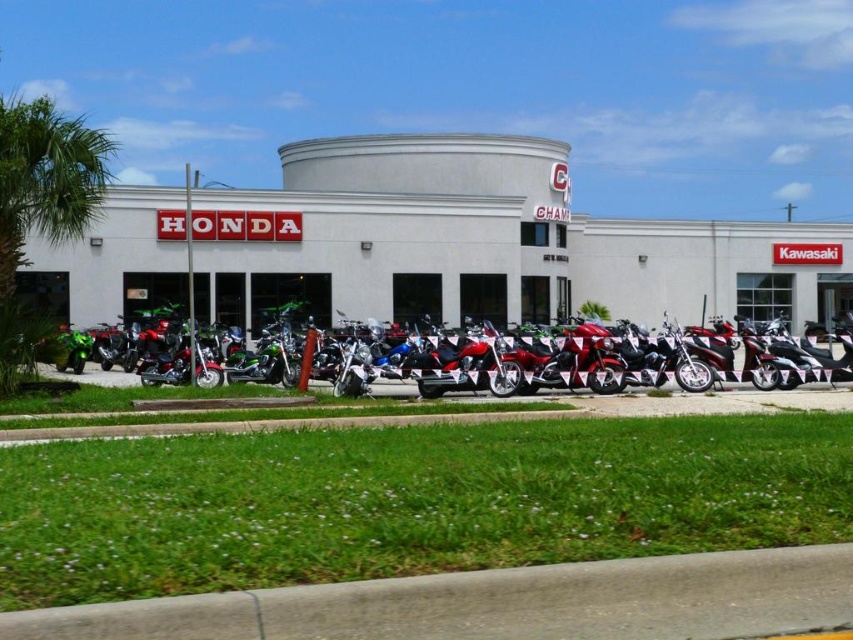
You are a delivery person who needs to place a new motorcycle that is 3 feet wide in between the green leafy palm tree at left and the shiny chrome motorcycle at center. Can you fit the new motorcycle there?

The green leafy palm tree at left is 43.66 feet away from the shiny chrome motorcycle at center. Since the new motorcycle is only 3 feet wide, there is sufficient space between them to accommodate it.

You are standing in front of the motorcycle dealership and want to know which of the two points, point (51, 161) or point (122, 374), is closer to you. Based on the scene, can you determine this?

Point (51, 161) is closer to the viewer than point (122, 374).

You are a customer at the motorcycle dealership and want to take a photo of both the green leafy palm tree at left and the green matte motorcycle at center. Can you position yourself in a way that both objects are visible in your camera frame?

The green leafy palm tree at left is located above the green matte motorcycle at center, so yes, you can position yourself in a way that both objects are visible in your camera frame by angling the camera upwards to include the palm tree above the motorcycle.